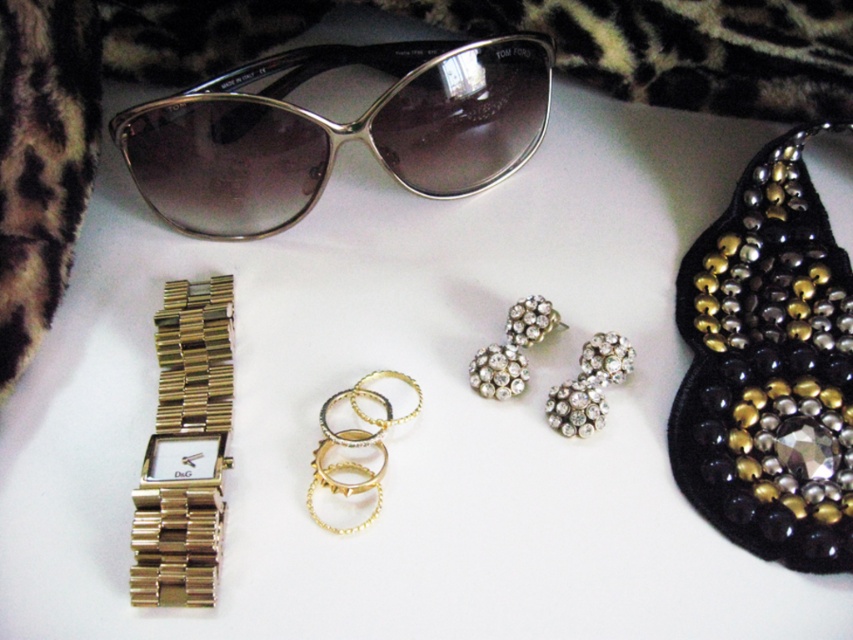
Question: Is silver metallic sunglasses at upper center to the right of gold metallic rings at center from the viewer's perspective?

Choices:
 (A) yes
 (B) no

Answer: (B)

Question: Where is silver metallic sunglasses at upper center located in relation to gold metallic rings at center in the image?

Choices:
 (A) left
 (B) right

Answer: (A)

Question: Which is nearer to the clear crystal earrings at center?

Choices:
 (A) gold metallic watch at upper left
 (B) black sequined necklace at upper right
 (C) gold metallic rings at center

Answer: (C)

Question: Is the position of black sequined necklace at upper right more distant than that of silver metallic sunglasses at upper center?

Choices:
 (A) no
 (B) yes

Answer: (A)

Question: Which point is closer to the camera?

Choices:
 (A) (519, 323)
 (B) (227, 433)

Answer: (B)

Question: Which object is closer to the camera taking this photo?

Choices:
 (A) gold metallic watch at upper left
 (B) gold metallic rings at center
 (C) black sequined necklace at upper right
 (D) clear crystal earrings at center

Answer: (A)